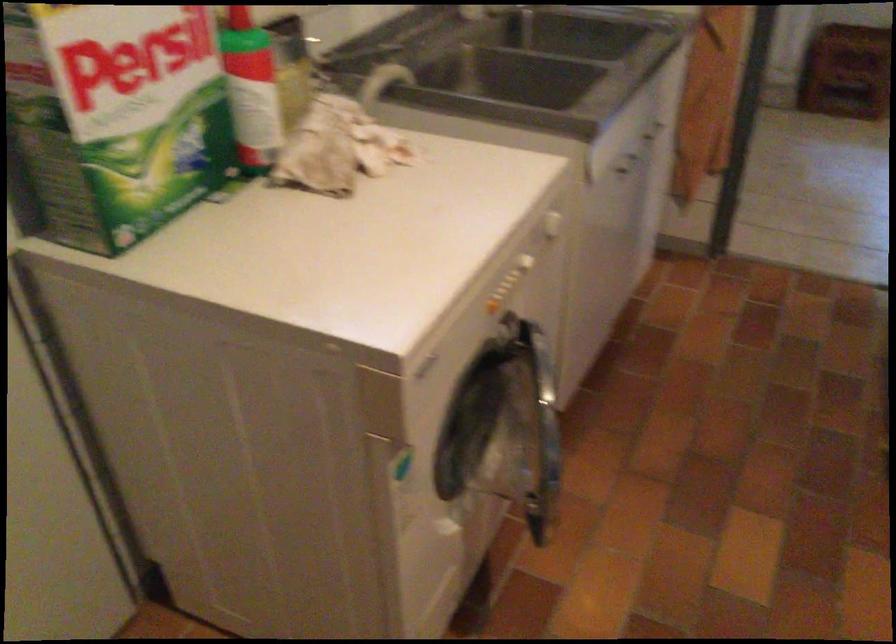
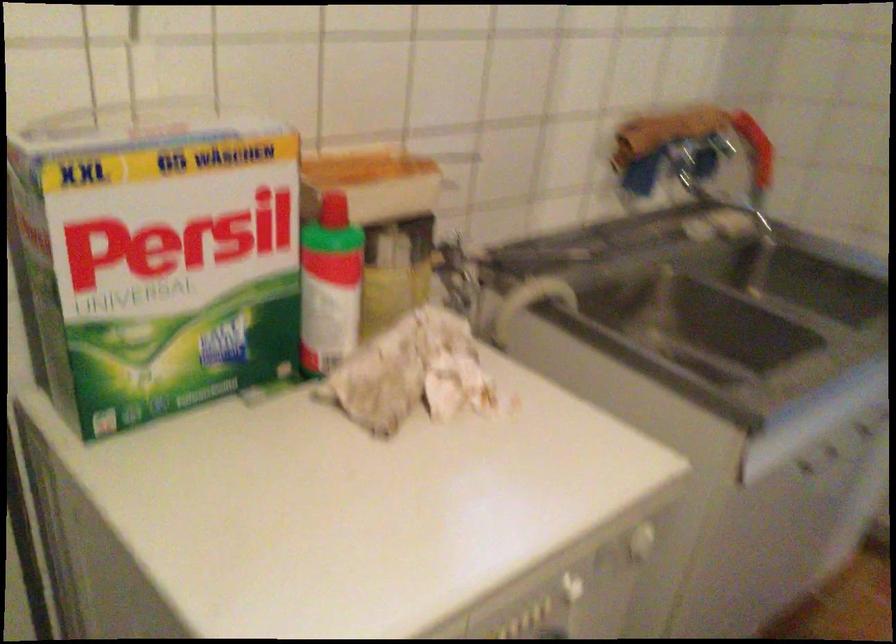
Question: The images are taken continuously from a first-person perspective. In which direction is your viewpoint rotating?

Choices:
 (A) Left
 (B) Right
 (C) Up
 (D) Down

Answer: (A)